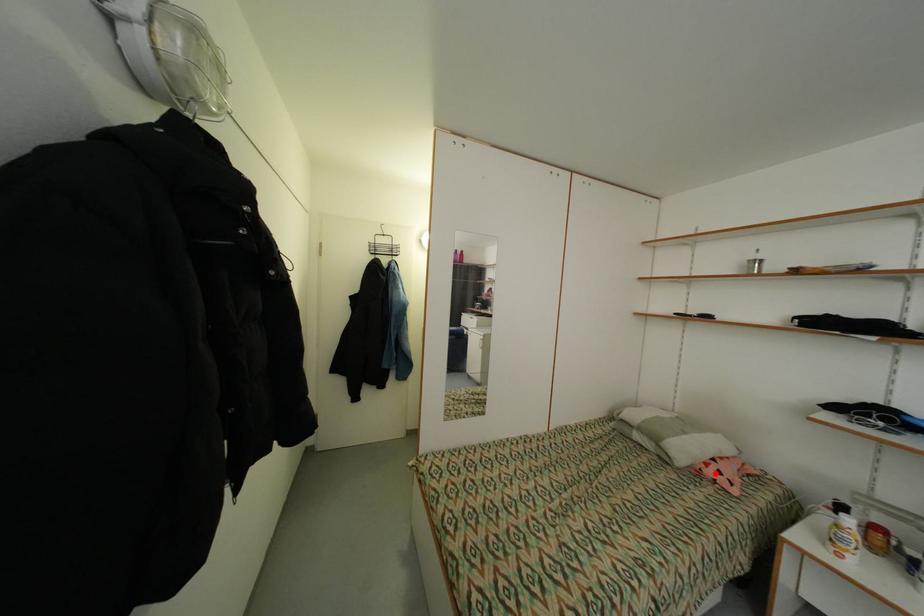
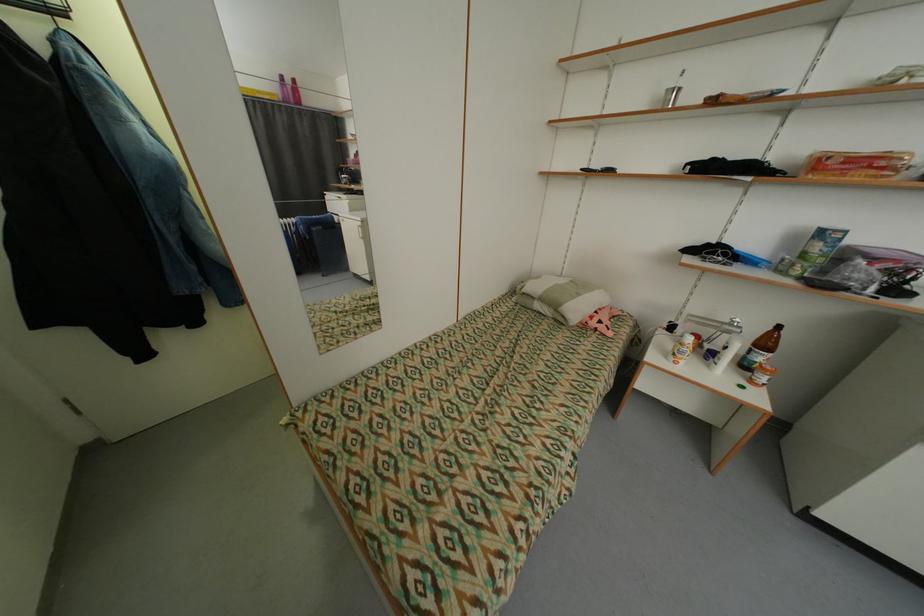
The point at the highlighted location is marked in the first image. Where is the corresponding point in the second image?

(600, 323)